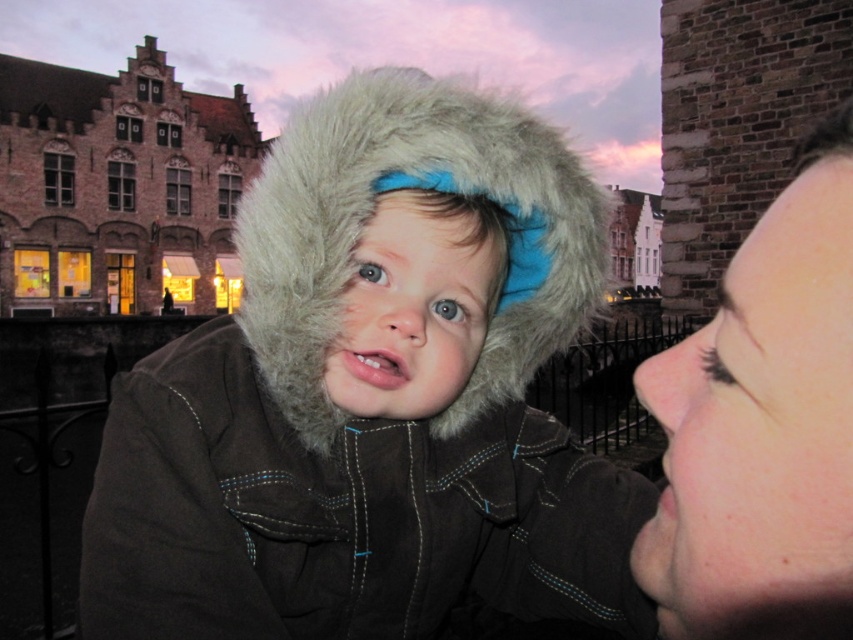
Based on the scene description, where is the smooth skin face at upper right positioned in relation to the European building?

The smooth skin face at upper right is positioned at coordinates approximately 0.667 on the x axis and 0.896 on the y axis relative to the European building.

What is the exact location of the fuzzy brown coat at center in the image?

The fuzzy brown coat at center is located at point (373, 396).

You are helping a child find their way home. You see a fuzzy brown coat at center and a fuzzy fur hood at center. Which item is positioned to the right of the other?

The fuzzy brown coat at center is to the right of the fuzzy fur hood at center.